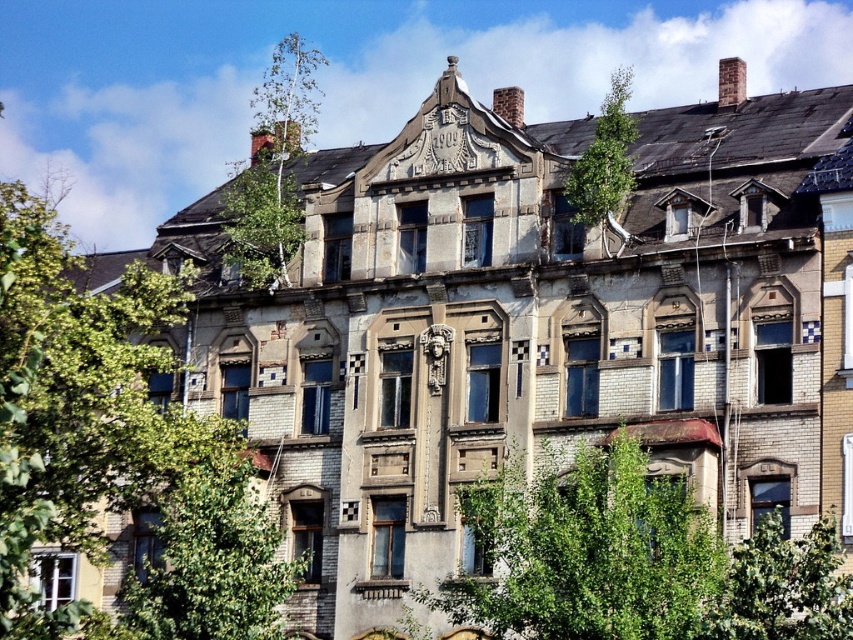
You are standing in front of the residential building and notice two green leafy trees in the upper part of the image. Which tree is closer to you, the green leafy tree at upper left or the green leafy tree at upper center?

The green leafy tree at upper left is closer to you because it is in front of the green leafy tree at upper center.

Based on the photo, you are a window washer standing on the ground floor of the residential building. You see the green leafy tree at upper center and the green leafy tree at lower right. Which tree is closer to the ground floor?

The green leafy tree at lower right is closer to the ground floor because it is positioned below the green leafy tree at upper center.